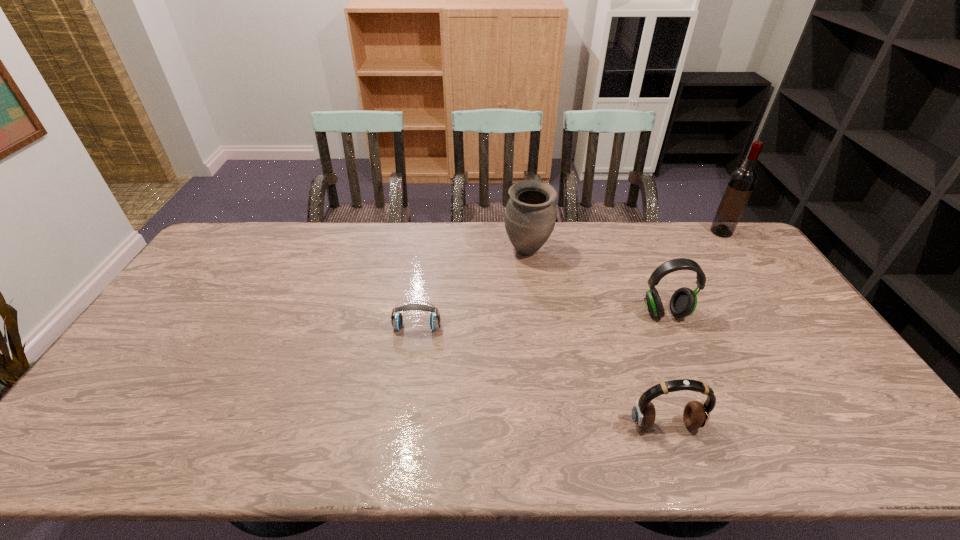
You are a GUI agent. You are given a task and a screenshot of the screen. Output one action in this format:
    pyautogui.click(x=<x>, y=<y>)
    Task: Click on the vacant space located on the front of the urn
    The width and height of the screenshot is (960, 540).
    Given the screenshot: What is the action you would take?
    pyautogui.click(x=540, y=351)

Identify the location of vacant position located on the ear cups of the third tallest object. This screenshot has width=960, height=540. (710, 415).

This screenshot has width=960, height=540. I want to click on vacant space positioned on the ear cups of the leftmost headset, so click(x=402, y=429).

Where is `wine bottle that is at the far edge`? wine bottle that is at the far edge is located at coordinates pos(742,181).

The height and width of the screenshot is (540, 960). In order to click on urn situated at the far edge in this screenshot , I will do `click(530, 215)`.

Find the location of `object at the near edge`. object at the near edge is located at coordinates (696, 414).

Image resolution: width=960 pixels, height=540 pixels. In order to click on object present at the right edge in this screenshot , I will do `click(742, 181)`.

Where is `object present at the far right corner`? This screenshot has height=540, width=960. object present at the far right corner is located at coordinates (742, 181).

This screenshot has width=960, height=540. Identify the location of vacant space at the far edge. pos(612,247).

Where is `vacant space at the left edge of the desktop`? This screenshot has width=960, height=540. vacant space at the left edge of the desktop is located at coordinates (166, 347).